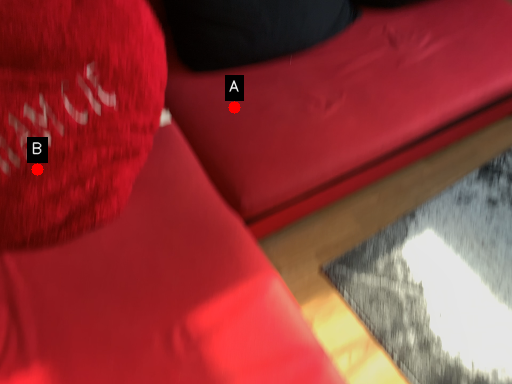
Question: Two points are circled on the image, labeled by A and B beside each circle. Which point is farther to the camera?

Choices:
 (A) A is further
 (B) B is further

Answer: (A)